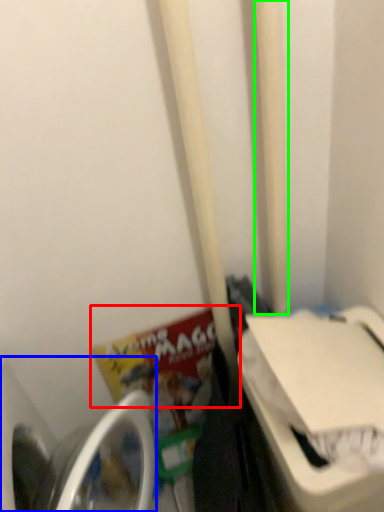
Question: Which is farther away from book (highlighted by a red box)? washing machine (highlighted by a blue box) or pole (highlighted by a green box)?

Choices:
 (A) washing machine
 (B) pole

Answer: (B)